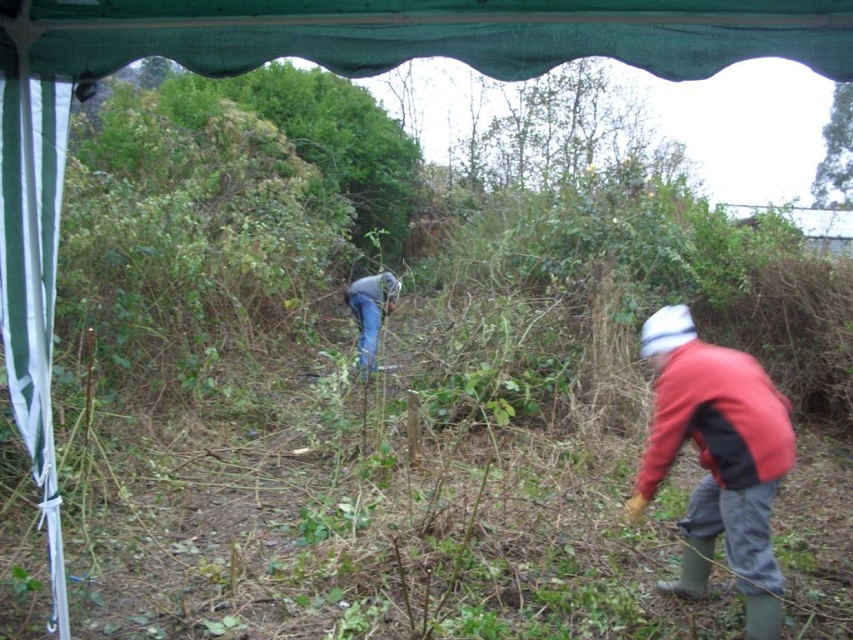
Does red matte jacket at lower right appear on the left side of denim jeans at center?

Incorrect, red matte jacket at lower right is not on the left side of denim jeans at center.

Is red matte jacket at lower right further to camera compared to denim jeans at center?

That is False.

Is point (712, 348) more distant than point (392, 301)?

No, it is not.

Image resolution: width=853 pixels, height=640 pixels. Find the location of `red matte jacket at lower right`. red matte jacket at lower right is located at coordinates click(x=717, y=460).